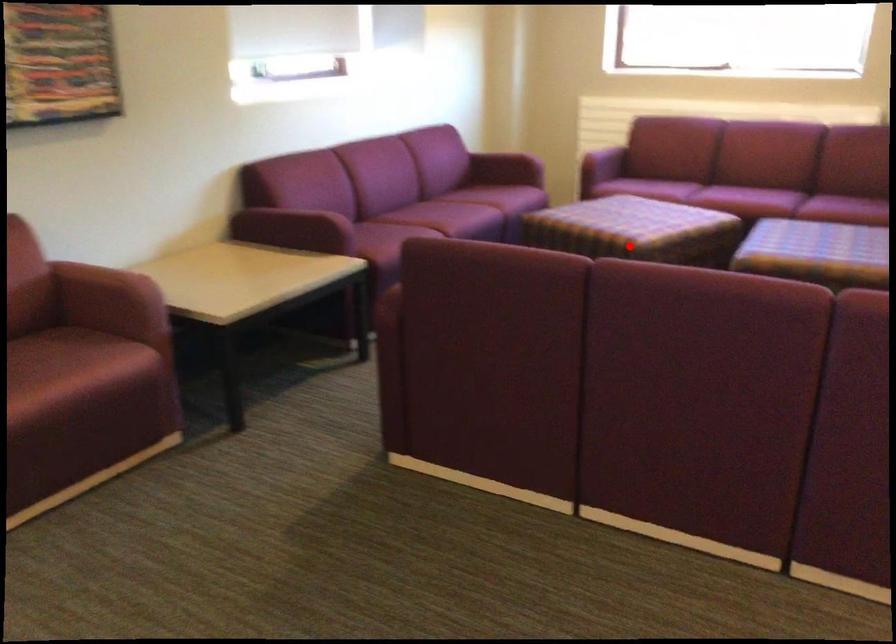
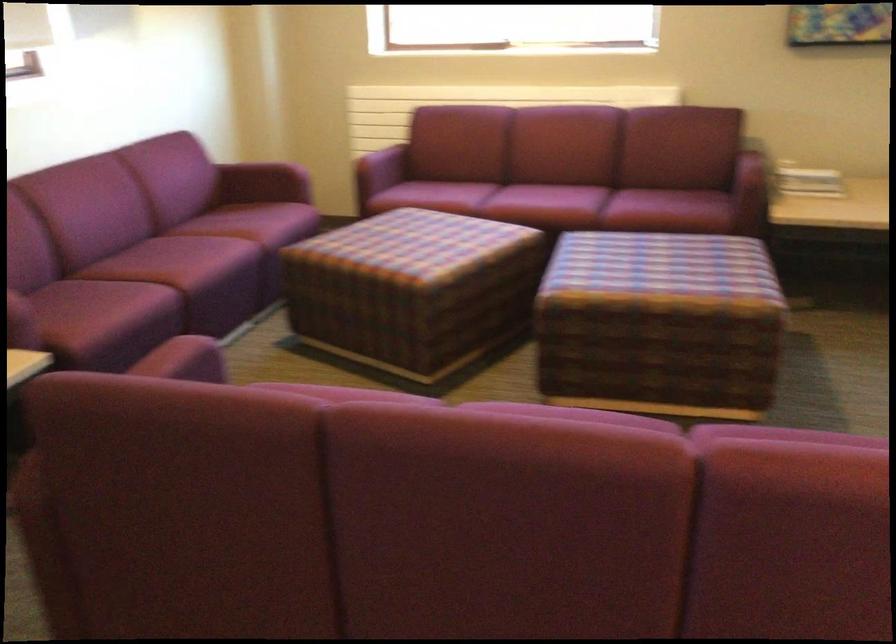
Question: I am providing you with two images of the same scene from different viewpoints. In image1, a red point is highlighted. Considering the same 3D point in image2, which of the following is correct?

Choices:
 (A) It is closer
 (B) It is farther

Answer: (A)